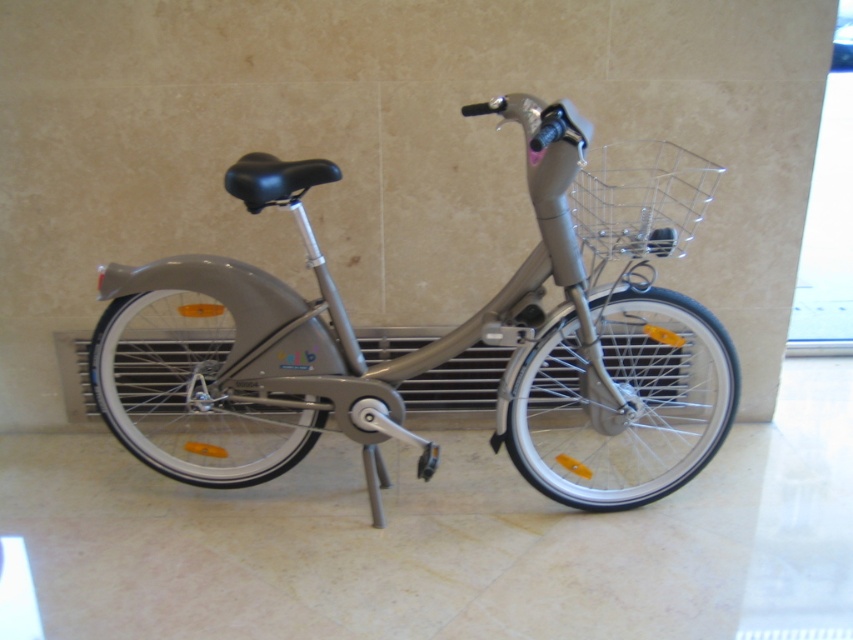
Which is behind, point (317, 410) or point (432, 374)?

Positioned behind is point (432, 374).

Between point (160, 307) and point (73, 396), which one is positioned behind?

The point (73, 396) is more distant.

You are a GUI agent. You are given a task and a screenshot of the screen. Output one action in this format:
    pyautogui.click(x=<x>, y=<y>)
    Task: Click on the metallic gray bicycle at center
    Image resolution: width=853 pixels, height=640 pixels.
    Given the screenshot: What is the action you would take?
    pyautogui.click(x=440, y=337)

From the picture: Who is more distant from viewer, (x=300, y=422) or (x=664, y=237)?

The point (x=300, y=422) is more distant.

Which is in front, point (465, 108) or point (651, 248)?

Point (465, 108) is more forward.

Where is `metallic gray bicycle at center`? The height and width of the screenshot is (640, 853). metallic gray bicycle at center is located at coordinates (440, 337).

How much distance is there between metallic wire basket at upper right and metallic gray radiator at center?

metallic wire basket at upper right is 67.31 centimeters away from metallic gray radiator at center.

Can you confirm if metallic wire basket at upper right is taller than metallic gray radiator at center?

Correct, metallic wire basket at upper right is much taller as metallic gray radiator at center.

Is point (663, 164) positioned after point (467, 408)?

No, (663, 164) is closer to viewer.

Identify the location of metallic wire basket at upper right. (640, 198).